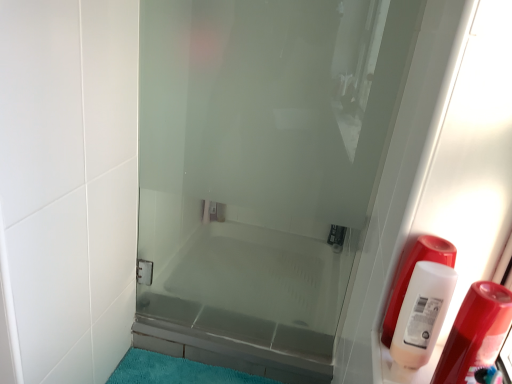
Find the location of a particular element. The height and width of the screenshot is (384, 512). white plastic bottle at right is located at coordinates (475, 334).

At what (x,y) coordinates should I click in order to perform the action: click on teal plush bath mat at lower center. Please return your answer as a coordinate pair (x, y). The image size is (512, 384). Looking at the image, I should click on (176, 371).

At what (x,y) coordinates should I click in order to perform the action: click on transparent glass door at center. Please return your answer as a coordinate pair (x, y). This screenshot has width=512, height=384. Looking at the image, I should click on (260, 172).

The width and height of the screenshot is (512, 384). I want to click on white plastic bottle at right, so click(475, 334).

In terms of width, does transparent glass door at center look wider or thinner when compared to white plastic bottle at right?

Considering their sizes, transparent glass door at center looks slimmer than white plastic bottle at right.

From the image's perspective, is transparent glass door at center located above white plastic bottle at right?

Yes, from the image's perspective, transparent glass door at center is over white plastic bottle at right.

Is transparent glass door at center turned away from white plastic bottle at right?

transparent glass door at center is not turned away from white plastic bottle at right.

From a real-world perspective, relative to white plastic bottle at right, is transparent glass door at center vertically above or below?

From a real-world perspective, transparent glass door at center is physically below white plastic bottle at right.

What's the angular difference between teal plush bath mat at lower center and white plastic bottle at right's facing directions?

0.449 degrees separate the facing orientations of teal plush bath mat at lower center and white plastic bottle at right.

Does teal plush bath mat at lower center contain white plastic bottle at right?

Actually, white plastic bottle at right is outside teal plush bath mat at lower center.

Is teal plush bath mat at lower center facing away from white plastic bottle at right?

No, white plastic bottle at right is not at the back of teal plush bath mat at lower center.

Which object is further away from the camera taking this photo, teal plush bath mat at lower center or white plastic bottle at right?

teal plush bath mat at lower center is more distant.

How many degrees apart are the facing directions of white plastic bottle at right and transparent glass door at center?

There is a 1.14-degree angle between the facing directions of white plastic bottle at right and transparent glass door at center.

Considering the positions of points (437, 378) and (358, 250), is point (437, 378) closer to camera compared to point (358, 250)?

Yes, point (437, 378) is closer to viewer.

From a real-world perspective, is white plastic bottle at right physically located above or below transparent glass door at center?

From a real-world perspective, white plastic bottle at right is physically above transparent glass door at center.

How much distance is there between white plastic bottle at right and transparent glass door at center?

white plastic bottle at right is 3.49 feet away from transparent glass door at center.

Choose the correct answer: Is white plastic bottle at right inside white plastic bottle at right or outside it?

white plastic bottle at right is located beyond the bounds of white plastic bottle at right.

Locate an element on the screen. soap dispenser in front of the white plastic bottle at right is located at coordinates (475, 334).

From a real-world perspective, is teal plush bath mat at lower center positioned under transparent glass door at center based on gravity?

Yes, from a real-world perspective, teal plush bath mat at lower center is under transparent glass door at center.

Does point (185, 367) come behind point (139, 226)?

No, (185, 367) is closer to viewer.

Is teal plush bath mat at lower center to the left or to the right of transparent glass door at center in the image?

In the image, teal plush bath mat at lower center appears on the left side of transparent glass door at center.

What's the angular difference between teal plush bath mat at lower center and transparent glass door at center's facing directions?

0.691 degrees.

At what (x,y) coordinates should I click in order to perform the action: click on door located above the white plastic bottle at right (from the image's perspective). Please return your answer as a coordinate pair (x, y). This screenshot has width=512, height=384. Looking at the image, I should click on (260, 172).

From the picture: Do you think white plastic bottle at right is within transparent glass door at center, or outside of it?

white plastic bottle at right is not inside transparent glass door at center, it's outside.

From a real-world perspective, is white plastic bottle at right physically above transparent glass door at center?

Correct, in the physical world, white plastic bottle at right is higher than transparent glass door at center.

What's the angular difference between white plastic bottle at right and transparent glass door at center's facing directions?

The angle between the facing direction of white plastic bottle at right and the facing direction of transparent glass door at center is 1.14 degrees.

Is transparent glass door at center positioned with its back to white plastic bottle at right?

No.

Can you confirm if transparent glass door at center is bigger than white plastic bottle at right?

Correct, transparent glass door at center is larger in size than white plastic bottle at right.

From a real-world perspective, between transparent glass door at center and white plastic bottle at right, who is vertically higher?

In real-world perspective, white plastic bottle at right is above.

Is transparent glass door at center in front of or behind white plastic bottle at right in the image?

transparent glass door at center is behind white plastic bottle at right.

This screenshot has width=512, height=384. Identify the location of cleaning product on the right side of transparent glass door at center. (422, 313).

Where is `bath mat behind the white plastic bottle at right`? The image size is (512, 384). bath mat behind the white plastic bottle at right is located at coordinates (176, 371).

Estimate the real-world distances between objects in this image. Which object is further from white plastic bottle at right, transparent glass door at center or white plastic bottle at right?

transparent glass door at center lies further to white plastic bottle at right than the other object.

Considering their positions, is teal plush bath mat at lower center positioned further to white plastic bottle at right than transparent glass door at center?

Among the two, transparent glass door at center is located further to white plastic bottle at right.

Based on their spatial positions, is white plastic bottle at right or white plastic bottle at right further from transparent glass door at center?

white plastic bottle at right is further to transparent glass door at center.

When comparing their distances from transparent glass door at center, does white plastic bottle at right or teal plush bath mat at lower center seem further?

white plastic bottle at right lies further to transparent glass door at center than the other object.

Based on their spatial positions, is transparent glass door at center or white plastic bottle at right further from white plastic bottle at right?

transparent glass door at center is further to white plastic bottle at right.

When comparing their distances from transparent glass door at center, does teal plush bath mat at lower center or white plastic bottle at right seem closer?

Based on the image, teal plush bath mat at lower center appears to be nearer to transparent glass door at center.

From the image, which object appears to be farther from white plastic bottle at right, white plastic bottle at right or transparent glass door at center?

Among the two, transparent glass door at center is located further to white plastic bottle at right.

Based on their spatial positions, is white plastic bottle at right or teal plush bath mat at lower center closer to white plastic bottle at right?

The object closer to white plastic bottle at right is white plastic bottle at right.

Locate an element on the screen. The width and height of the screenshot is (512, 384). cleaning product between white plastic bottle at right and transparent glass door at center from front to back is located at coordinates (422, 313).

Locate an element on the screen. The image size is (512, 384). cleaning product between transparent glass door at center and teal plush bath mat at lower center from top to bottom is located at coordinates (422, 313).

The height and width of the screenshot is (384, 512). In order to click on door between white plastic bottle at right and teal plush bath mat at lower center in the front-back direction in this screenshot , I will do `click(260, 172)`.

The height and width of the screenshot is (384, 512). I want to click on cleaning product between white plastic bottle at right and teal plush bath mat at lower center from front to back, so click(x=422, y=313).